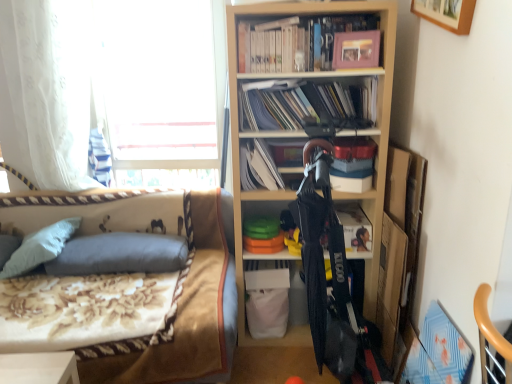
Question: Is white sheer curtain at left placed right next to matte black book at center, which ranks as the 1th book in bottom-to-top order?

Choices:
 (A) no
 (B) yes

Answer: (A)

Question: Is white sheer curtain at left looking in the opposite direction of matte black book at center, acting as the fourth book starting from the top?

Choices:
 (A) yes
 (B) no

Answer: (B)

Question: Can matte black book at center, which ranks as the 1th book in bottom-to-top order, be found inside white sheer curtain at left?

Choices:
 (A) no
 (B) yes

Answer: (A)

Question: Is white sheer curtain at left smaller than matte black book at center, acting as the fourth book starting from the top?

Choices:
 (A) no
 (B) yes

Answer: (A)

Question: From the image's perspective, is white sheer curtain at left under matte black book at center, acting as the fourth book starting from the top?

Choices:
 (A) yes
 (B) no

Answer: (B)

Question: Can you confirm if white sheer curtain at left is taller than matte black book at center, acting as the fourth book starting from the top?

Choices:
 (A) yes
 (B) no

Answer: (A)

Question: From a real-world perspective, is gray fabric pillow at left, which ranks as the 1th pillow in left-to-right order, beneath white paper at center, the third book in the top-to-bottom sequence?

Choices:
 (A) no
 (B) yes

Answer: (B)

Question: Can you confirm if gray fabric pillow at left, which ranks as the 2th pillow in right-to-left order, is smaller than white paper at center, the third book in the top-to-bottom sequence?

Choices:
 (A) no
 (B) yes

Answer: (A)

Question: Is gray fabric pillow at left, which ranks as the 2th pillow in right-to-left order, at the right side of white paper at center, which ranks as the 2th book in bottom-to-top order?

Choices:
 (A) no
 (B) yes

Answer: (A)

Question: Does gray fabric pillow at left, which ranks as the 1th pillow in left-to-right order, lie behind white paper at center, which ranks as the 2th book in bottom-to-top order?

Choices:
 (A) no
 (B) yes

Answer: (B)

Question: Can you confirm if gray fabric pillow at left, which ranks as the 1th pillow in left-to-right order, is positioned to the left of white paper at center, the third book in the top-to-bottom sequence?

Choices:
 (A) yes
 (B) no

Answer: (A)

Question: Can you confirm if gray fabric pillow at left, which ranks as the 2th pillow in right-to-left order, is wider than white paper at center, which ranks as the 2th book in bottom-to-top order?

Choices:
 (A) yes
 (B) no

Answer: (A)

Question: Does white paper at center, the third book in the top-to-bottom sequence, appear on the left side of wooden bookshelf at center?

Choices:
 (A) no
 (B) yes

Answer: (B)